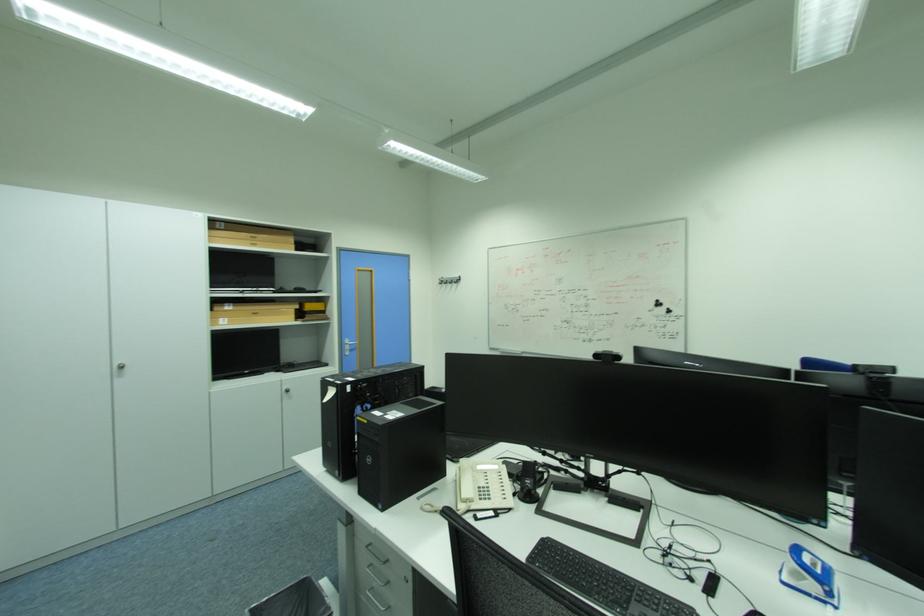
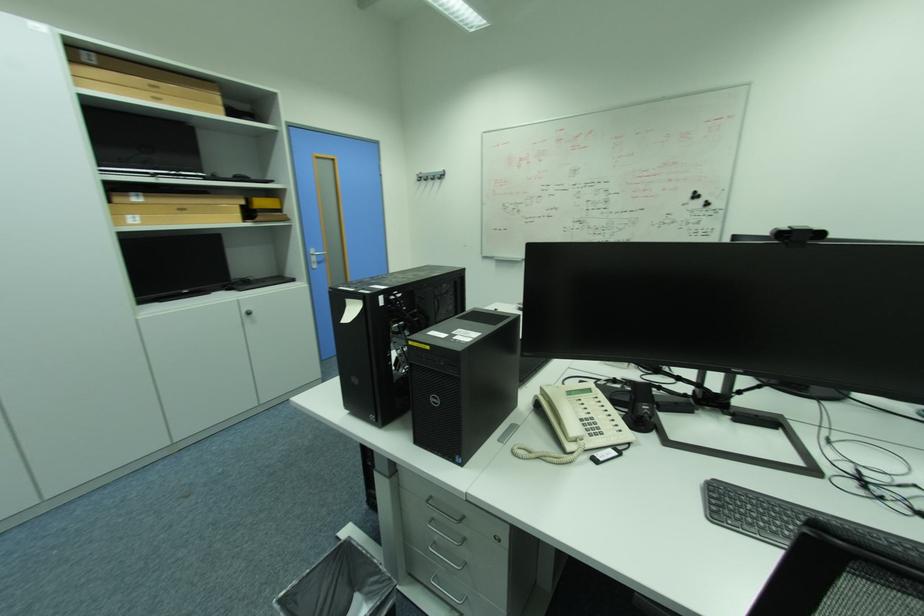
In the second image, find the point that corresponds to the point at 296,391 in the first image.

(257, 314)